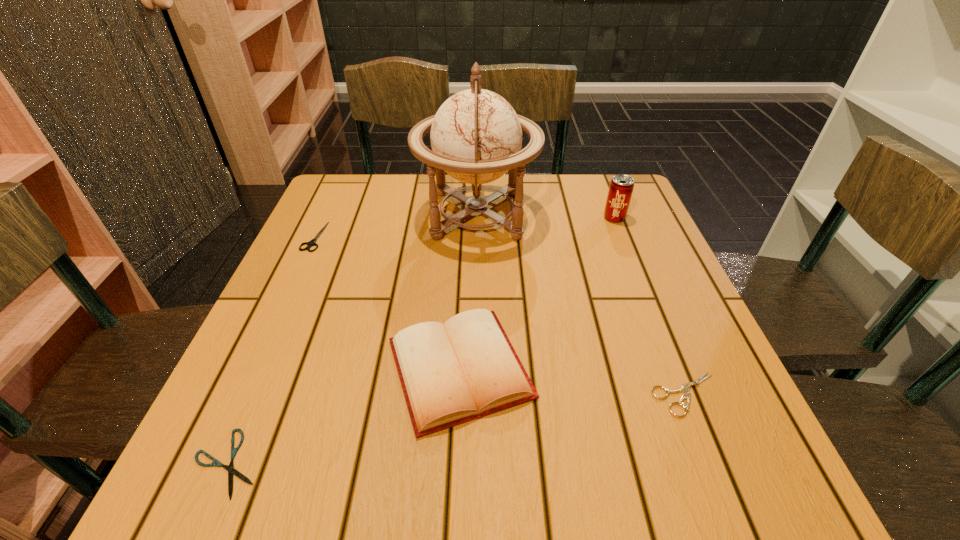
The image size is (960, 540). I want to click on vacant region located 0.070m on the left of the beer can, so pyautogui.click(x=576, y=218).

The height and width of the screenshot is (540, 960). Identify the location of vacant area situated on the back of the Bible. (464, 279).

You are a GUI agent. You are given a task and a screenshot of the screen. Output one action in this format:
    pyautogui.click(x=<x>, y=<y>)
    Task: Click on the blank space located on the front of the farthest shears
    
    Given the screenshot: What is the action you would take?
    pyautogui.click(x=252, y=370)

Find the location of a particular element. The height and width of the screenshot is (540, 960). free spot located 0.280m on the back of the second shortest shears is located at coordinates (636, 268).

You are a GUI agent. You are given a task and a screenshot of the screen. Output one action in this format:
    pyautogui.click(x=<x>, y=<y>)
    Task: Click on the vacant space located on the right of the nearest shears
    
    Given the screenshot: What is the action you would take?
    (411, 463)

The image size is (960, 540). Identify the location of globe that is at the far edge. (476, 136).

Where is `beer can present at the far edge`? The height and width of the screenshot is (540, 960). beer can present at the far edge is located at coordinates (621, 187).

Where is `shears located in the far edge section of the desktop`? The height and width of the screenshot is (540, 960). shears located in the far edge section of the desktop is located at coordinates (312, 242).

The height and width of the screenshot is (540, 960). I want to click on object that is positioned at the near edge, so click(x=230, y=468).

Identify the location of beer can at the right edge. The image size is (960, 540). (621, 187).